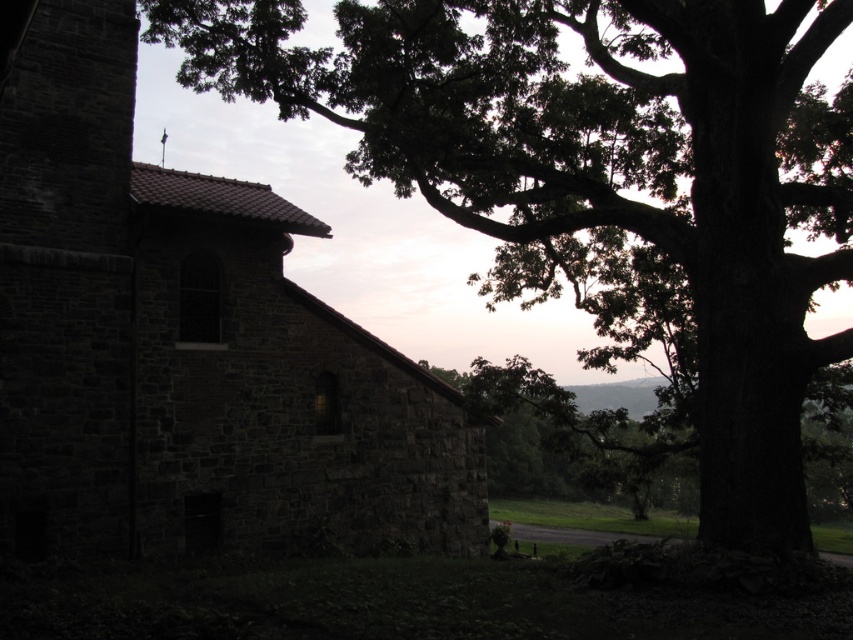
You are standing in front of the stone building and notice a point marked at coordinates (602, 179). What object is located at this point?

The point at coordinates (602, 179) indicates the dark green leafy tree at upper right.

You are standing in a field looking at the dark green leafy tree at upper right and the dark stone church at left. Which object is closer to you?

The dark green leafy tree at upper right is closer to you because it is further to the viewer than the dark stone church at left.

You are a photographer planning to capture the dark green leafy tree at upper right and the dark stone church at left in a single frame. Based on their sizes, which object will occupy more space in your photo?

The dark green leafy tree at upper right will occupy more space in the photo since it is larger in size than the dark stone church at left according to the description.